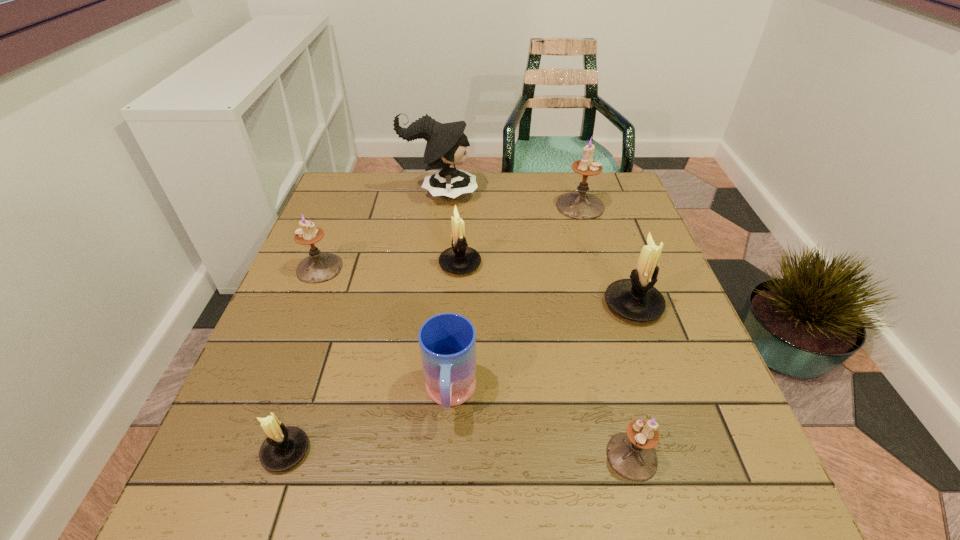
This screenshot has height=540, width=960. Identify the location of the nearest purple candle holder. (631, 454).

Find the location of a particular element. The width and height of the screenshot is (960, 540). the nearest white candle holder is located at coordinates (284, 447).

In order to click on the smallest white candle holder in this screenshot , I will do `click(284, 447)`.

The image size is (960, 540). Find the location of `free location located at the face of the tallest object`. free location located at the face of the tallest object is located at coordinates (573, 193).

Image resolution: width=960 pixels, height=540 pixels. Identify the location of free location located 0.380m on the front of the farthest candle holder. (614, 322).

Identify the location of vacant space located 0.110m on the left of the biggest white candle holder. This screenshot has width=960, height=540. (556, 305).

Locate an element on the screen. blank space located 0.110m on the right of the leftmost purple candle holder is located at coordinates (386, 268).

This screenshot has width=960, height=540. Find the location of `vacant space situated on the right of the second white candle holder from right to left`. vacant space situated on the right of the second white candle holder from right to left is located at coordinates (641, 264).

Find the location of a particular element. free space located 0.130m on the right of the smallest purple candle holder is located at coordinates (734, 456).

The image size is (960, 540). What are the coordinates of `vacant space situated 0.260m on the right of the smallest white candle holder` in the screenshot? It's located at tap(462, 451).